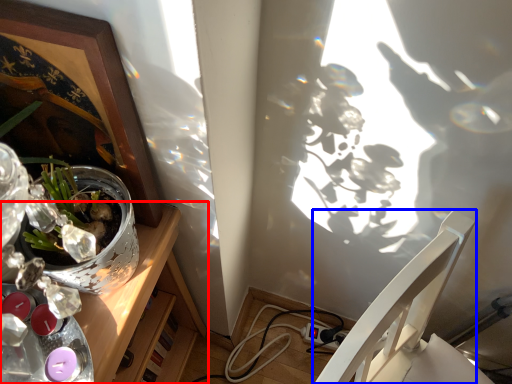
Question: Which of the following is the closest to the observer, desk (highlighted by a red box) or chair (highlighted by a blue box)?

Choices:
 (A) desk
 (B) chair

Answer: (B)